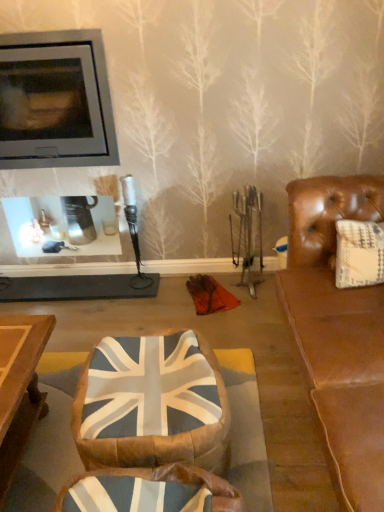
Question: From a real-world perspective, is union jack fabric bean bag at center physically located above or below matte gray fireplace at upper left?

Choices:
 (A) below
 (B) above

Answer: (A)

Question: Is point (165, 416) positioned closer to the camera than point (57, 129)?

Choices:
 (A) farther
 (B) closer

Answer: (B)

Question: In terms of width, does union jack fabric bean bag at center look wider or thinner when compared to matte gray fireplace at upper left?

Choices:
 (A) wide
 (B) thin

Answer: (A)

Question: Does point (76, 135) appear closer or farther from the camera than point (129, 397)?

Choices:
 (A) closer
 (B) farther

Answer: (B)

Question: From a real-world perspective, is matte gray fireplace at upper left above or below union jack fabric bean bag at center?

Choices:
 (A) below
 (B) above

Answer: (B)

Question: Is matte gray fireplace at upper left taller or shorter than union jack fabric bean bag at center?

Choices:
 (A) short
 (B) tall

Answer: (B)

Question: From the image's perspective, relative to union jack fabric bean bag at center, is matte gray fireplace at upper left above or below?

Choices:
 (A) above
 (B) below

Answer: (A)